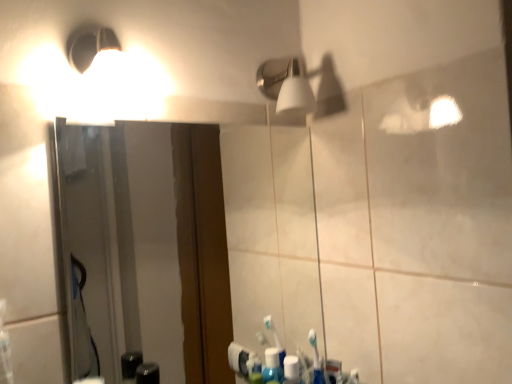
Question: Should I look upward or downward to see clear glass mirror at center?

Choices:
 (A) down
 (B) up

Answer: (A)

Question: Does white matte light fixture at upper center have a larger size compared to clear glass mirror at center?

Choices:
 (A) yes
 (B) no

Answer: (B)

Question: From a real-world perspective, is white matte light fixture at upper center below clear glass mirror at center?

Choices:
 (A) yes
 (B) no

Answer: (B)

Question: Does white matte light fixture at upper center turn towards clear glass mirror at center?

Choices:
 (A) yes
 (B) no

Answer: (B)

Question: Does white matte light fixture at upper center have a smaller size compared to clear glass mirror at center?

Choices:
 (A) no
 (B) yes

Answer: (B)

Question: Considering the relative sizes of white matte light fixture at upper center and clear glass mirror at center in the image provided, is white matte light fixture at upper center shorter than clear glass mirror at center?

Choices:
 (A) yes
 (B) no

Answer: (A)

Question: Is clear glass mirror at center inside white matte light fixture at upper center?

Choices:
 (A) yes
 (B) no

Answer: (B)

Question: Is clear glass mirror at center surrounding white matte light fixture at upper center?

Choices:
 (A) no
 (B) yes

Answer: (A)

Question: Can you confirm if clear glass mirror at center is shorter than white matte light fixture at upper center?

Choices:
 (A) no
 (B) yes

Answer: (A)

Question: Is clear glass mirror at center outside of white matte light fixture at upper center?

Choices:
 (A) no
 (B) yes

Answer: (B)

Question: Is the position of clear glass mirror at center less distant than that of white matte light fixture at upper center?

Choices:
 (A) yes
 (B) no

Answer: (A)

Question: Is the depth of clear glass mirror at center greater than that of white matte light fixture at upper center?

Choices:
 (A) no
 (B) yes

Answer: (A)

Question: Does clear glass mirror at center have a greater height compared to white matte light fixture at upper center?

Choices:
 (A) no
 (B) yes

Answer: (B)

Question: Based on their sizes in the image, would you say white matte light fixture at upper center is bigger or smaller than clear glass mirror at center?

Choices:
 (A) big
 (B) small

Answer: (B)